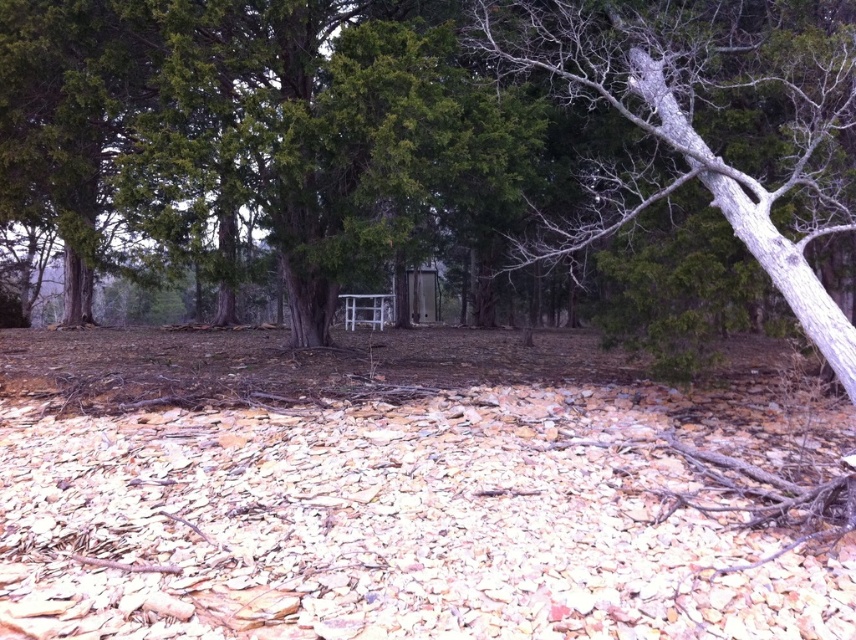
You are a hiker trying to cross the brown dirt field at center. There is a green rough bark tree at center nearby. Considering their sizes, which one do you think you can pass through more easily?

The brown dirt field at center has a smaller size compared to the green rough bark tree at center, so it is more likely that you can pass through the brown dirt field at center more easily since it occupies less space.

You are standing in the forest scene described. You notice two trees at the center of the image. Which tree is closer to you, the green rough bark tree at center or the gray bark tree at center?

The green rough bark tree at center is closer to you since it is positioned in front of the gray bark tree at center according to the description.

You are standing in the forest and want to walk towards the gray bark tree at center. Which direction should you move relative to the brown dirt field at center?

The gray bark tree at center is behind the brown dirt field at center, so you should move forward past the brown dirt field at center to reach the gray bark tree at center.